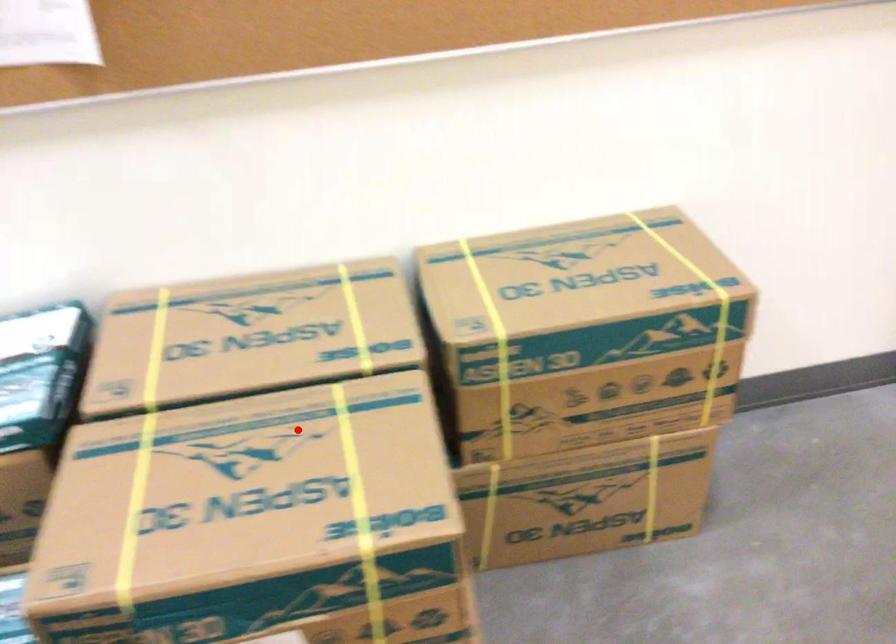
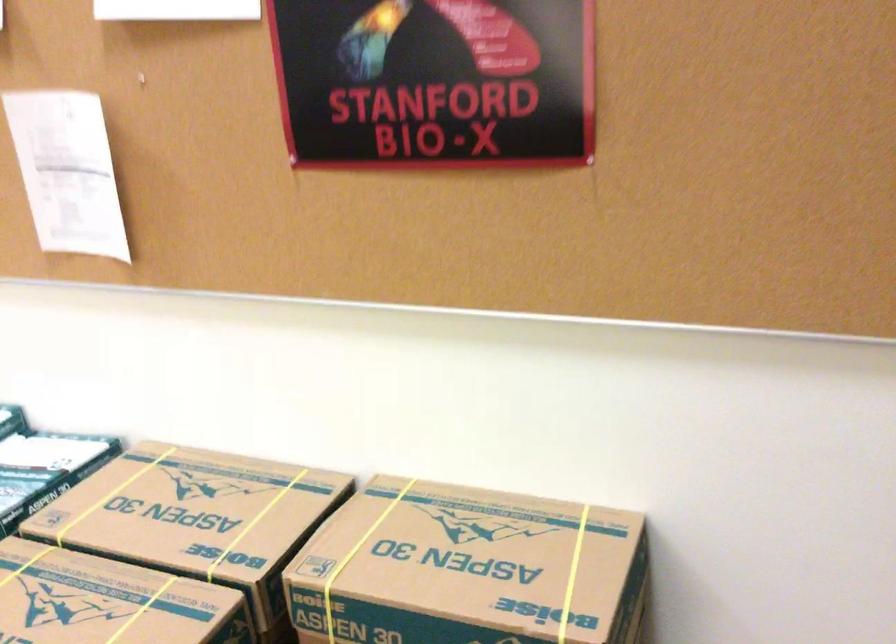
The point at the highlighted location is marked in the first image. Where is the corresponding point in the second image?

(108, 601)